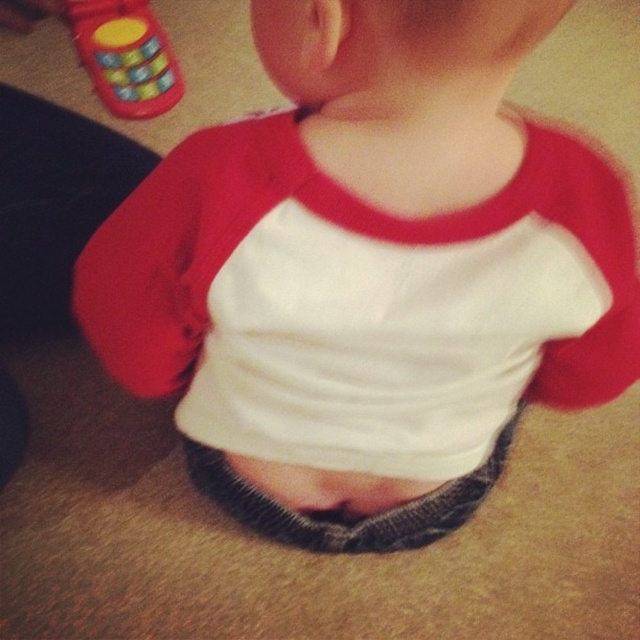
You are a photographer trying to capture the child in the image. If you want to ensure the rubberized plastic phone at upper left is not in the frame, what should you do?

Move the camera to the right since the rubberized plastic phone at upper left is located at the left side of the image, so moving right would exclude it from the frame.

You are a photographer setting up a shoot. You notice the rubberized plastic phone at upper left and the gray knitted fabric at center in the scene. Which object should you adjust to ensure the smaller one doesn

The gray knitted fabric at center should be adjusted because it is smaller than the rubberized plastic phone at upper left.

You are a photographer setting up a shoot. You need to decide whether to place the rubberized plastic phone at upper left and the gray knitted fabric at center in a way that they don not overlap. Based on their sizes, can you arrange them side by side without overlapping?

The rubberized plastic phone at upper left might be wider than gray knitted fabric at center, so arranging them side by side could result in overlapping if placed adjacent to each other. To avoid overlap, ensure there is sufficient spacing between them based on their widths.